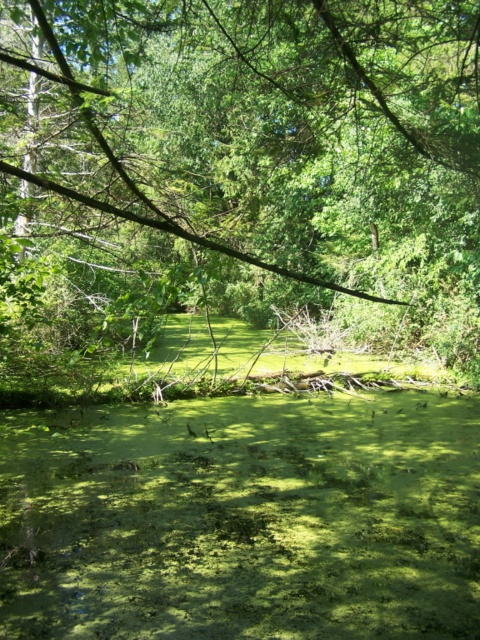
Which is more to the right, green leafy tree at center or green algae at center?

From the viewer's perspective, green algae at center appears more on the right side.

Consider the image. Who is taller, green leafy tree at center or green algae at center?

green leafy tree at center is taller.

The height and width of the screenshot is (640, 480). I want to click on green leafy tree at center, so [255, 157].